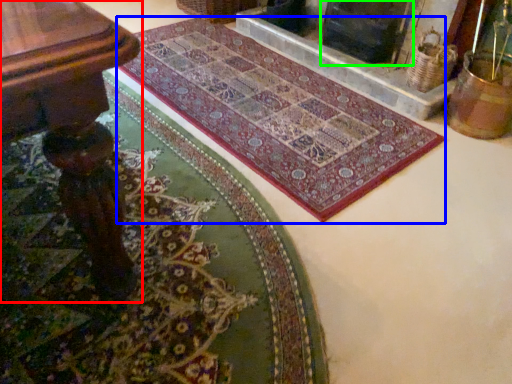
Question: Which object is positioned closest to table (highlighted by a red box)? Select from mat (highlighted by a blue box) and fireplace (highlighted by a green box).

Choices:
 (A) mat
 (B) fireplace

Answer: (A)